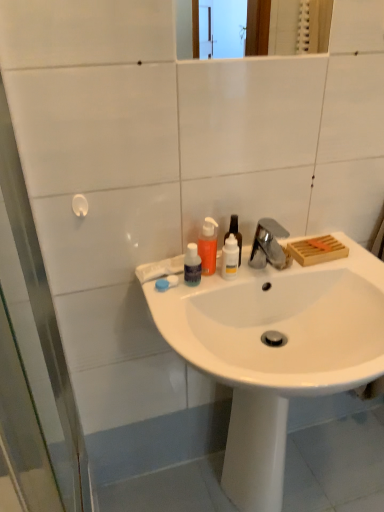
Question: Is transparent plastic bottle at center, placed as the 1th bottle when sorted from right to left, positioned before translucent plastic bottle at center, which is the 2th bottle from right to left?

Choices:
 (A) yes
 (B) no

Answer: (B)

Question: From a real-world perspective, is transparent plastic bottle at center, the fourth bottle positioned from the left, located higher than translucent plastic bottle at center, which is the 2th bottle from right to left?

Choices:
 (A) yes
 (B) no

Answer: (A)

Question: Can you confirm if transparent plastic bottle at center, placed as the 1th bottle when sorted from right to left, is positioned to the right of translucent plastic bottle at center, acting as the 3th bottle starting from the left?

Choices:
 (A) yes
 (B) no

Answer: (A)

Question: From the image's perspective, is transparent plastic bottle at center, placed as the 1th bottle when sorted from right to left, beneath translucent plastic bottle at center, which is the 2th bottle from right to left?

Choices:
 (A) no
 (B) yes

Answer: (A)

Question: Is transparent plastic bottle at center, placed as the 1th bottle when sorted from right to left, positioned with its back to translucent plastic bottle at center, acting as the 3th bottle starting from the left?

Choices:
 (A) yes
 (B) no

Answer: (B)

Question: From a real-world perspective, is transparent plastic bottle at center, placed as the 1th bottle when sorted from right to left, physically below translucent plastic bottle at center, acting as the 3th bottle starting from the left?

Choices:
 (A) yes
 (B) no

Answer: (B)

Question: Is white glossy sink at center facing away from translucent orange liquid at sink center, the 2th bottle in the left-to-right sequence?

Choices:
 (A) no
 (B) yes

Answer: (A)

Question: Is white glossy sink at center taller than translucent orange liquid at sink center, the 2th bottle in the left-to-right sequence?

Choices:
 (A) no
 (B) yes

Answer: (B)

Question: Does white glossy sink at center have a greater width compared to translucent orange liquid at sink center, acting as the third bottle starting from the right?

Choices:
 (A) yes
 (B) no

Answer: (A)

Question: From a real-world perspective, is white glossy sink at center positioned under translucent orange liquid at sink center, the 2th bottle in the left-to-right sequence, based on gravity?

Choices:
 (A) yes
 (B) no

Answer: (A)

Question: Can you confirm if white glossy sink at center is shorter than translucent orange liquid at sink center, acting as the third bottle starting from the right?

Choices:
 (A) no
 (B) yes

Answer: (A)

Question: Is white glossy sink at center positioned far away from translucent orange liquid at sink center, acting as the third bottle starting from the right?

Choices:
 (A) no
 (B) yes

Answer: (A)

Question: From a real-world perspective, is transparent plastic bottle at center, the fourth bottle positioned from the left, physically below satin nickel faucet at upper center?

Choices:
 (A) no
 (B) yes

Answer: (A)